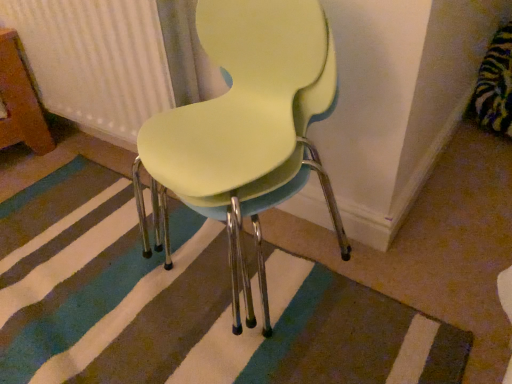
Question: Can you confirm if white textured radiator at upper left is thinner than striped carpet at center?

Choices:
 (A) no
 (B) yes

Answer: (B)

Question: Is striped carpet at center at the back of white textured radiator at upper left?

Choices:
 (A) no
 (B) yes

Answer: (A)

Question: Does white textured radiator at upper left have a greater width compared to striped carpet at center?

Choices:
 (A) yes
 (B) no

Answer: (B)

Question: Is white textured radiator at upper left shorter than striped carpet at center?

Choices:
 (A) no
 (B) yes

Answer: (A)

Question: Would you say white textured radiator at upper left is outside striped carpet at center?

Choices:
 (A) no
 (B) yes

Answer: (B)

Question: Considering the relative positions of white textured radiator at upper left and striped carpet at center in the image provided, is white textured radiator at upper left to the left of striped carpet at center from the viewer's perspective?

Choices:
 (A) no
 (B) yes

Answer: (B)

Question: Does white textured radiator at upper left come in front of matte yellow plastic chair at center?

Choices:
 (A) no
 (B) yes

Answer: (A)

Question: Is white textured radiator at upper left oriented away from matte yellow plastic chair at center?

Choices:
 (A) no
 (B) yes

Answer: (A)

Question: Is white textured radiator at upper left further to the viewer compared to matte yellow plastic chair at center?

Choices:
 (A) yes
 (B) no

Answer: (A)

Question: From a real-world perspective, is white textured radiator at upper left under matte yellow plastic chair at center?

Choices:
 (A) yes
 (B) no

Answer: (A)

Question: From the image's perspective, is white textured radiator at upper left on matte yellow plastic chair at center?

Choices:
 (A) no
 (B) yes

Answer: (B)

Question: Does white textured radiator at upper left have a larger size compared to matte yellow plastic chair at center?

Choices:
 (A) yes
 (B) no

Answer: (B)

Question: Is striped carpet at center inside matte yellow plastic chair at center?

Choices:
 (A) no
 (B) yes

Answer: (A)